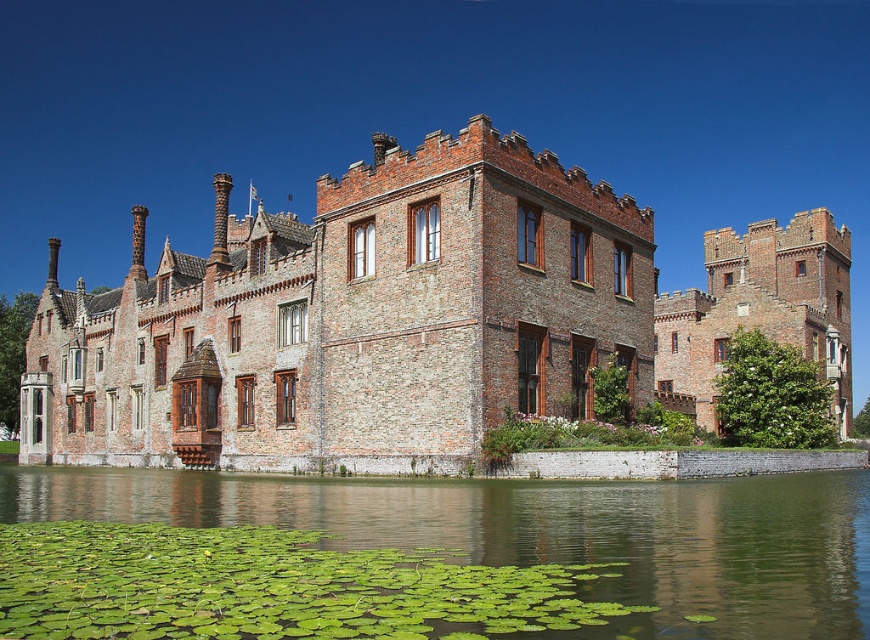
You are a painter planning to sketch the brown brick castle at center and the green leafy water at lower center. Which object should you focus on first if you want to capture the wider element in your painting?

The brown brick castle at center should be focused on first because its width surpasses that of the green leafy water at lower center.

Based on the photo, you are a tourist standing on the dock and want to take a photo of the brown brick castle at center and the green leafy water at lower center. Which object should you focus on first if you want to capture both in a single frame without moving the camera?

The brown brick castle at center is positioned over green leafy water at lower center, so you should focus on the brown brick castle at center first as it is closer to the camera and covers the green leafy water at lower center.

You are standing at the edge of the water in front of the brown brick castle at center. If you walk directly towards the point where the water surface meets the castle wall, will you reach the castle wall before or after reaching the lily pads?

The lily pads are on the water surface, so walking towards the castle wall would require passing through the lily pads first before reaching the castle wall.